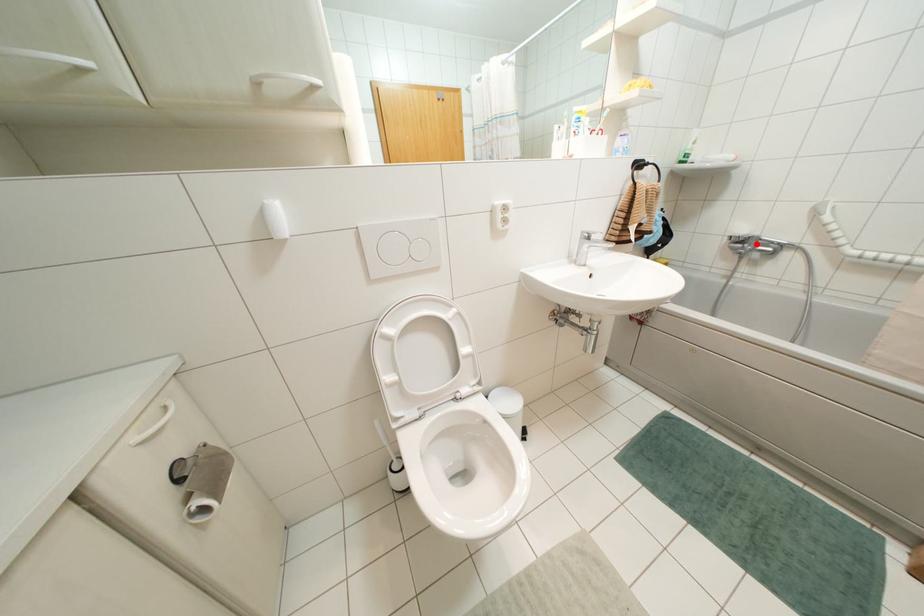
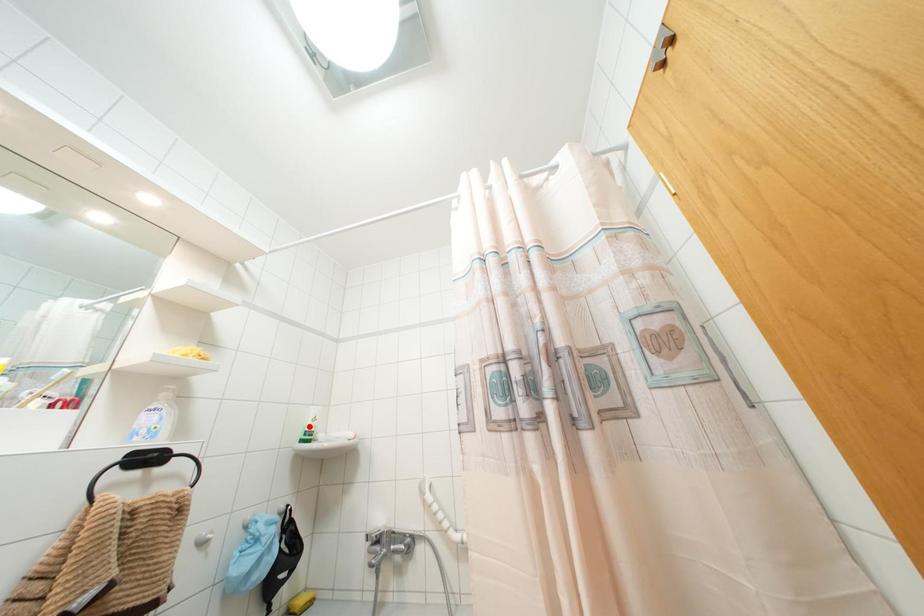
I am providing you with two images of the same scene from different viewpoints. A red point is marked on the first image and another point is marked on the second image. Are the points marked in image1 and image2 representing the same 3D position?

No